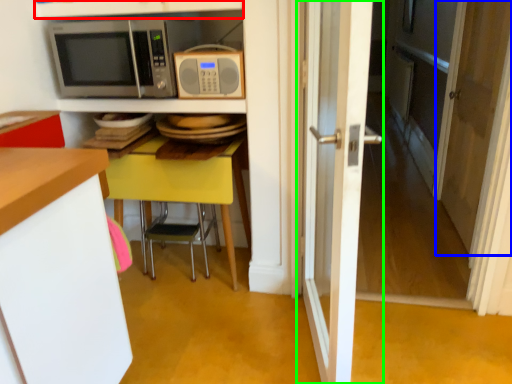
Question: Which is farther away from shelf (highlighted by a red box)? screen door (highlighted by a blue box) or door (highlighted by a green box)?

Choices:
 (A) screen door
 (B) door

Answer: (A)